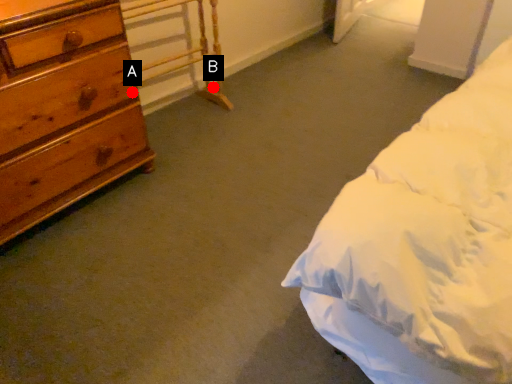
Question: Two points are circled on the image, labeled by A and B beside each circle. Which point is further to the camera?

Choices:
 (A) A is further
 (B) B is further

Answer: (B)